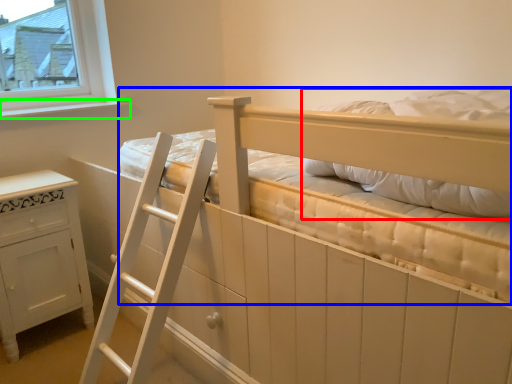
Question: Which object is positioned closest to pillow (highlighted by a red box)? Select from bed (highlighted by a blue box) and window sill (highlighted by a green box).

Choices:
 (A) bed
 (B) window sill

Answer: (A)